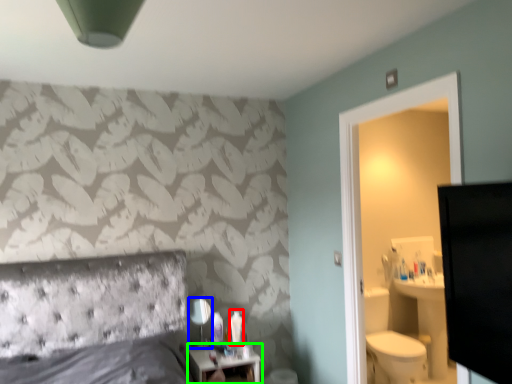
Question: Based on their relative distances, which object is nearer to toiletry (highlighted by a red box)? Choose from mirror (highlighted by a blue box) and nightstand (highlighted by a green box).

Choices:
 (A) mirror
 (B) nightstand

Answer: (B)